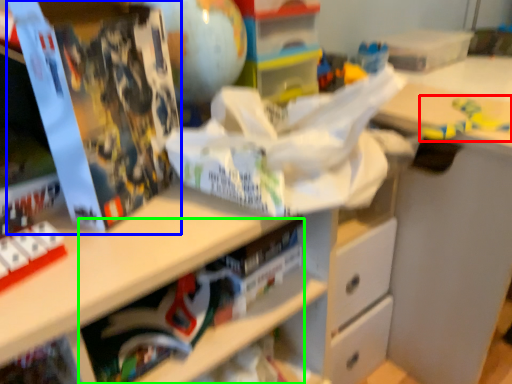
Question: Which object is positioned closest to toy (highlighted by a red box)? Select from paperback book (highlighted by a blue box) and book (highlighted by a green box).

Choices:
 (A) paperback book
 (B) book

Answer: (B)